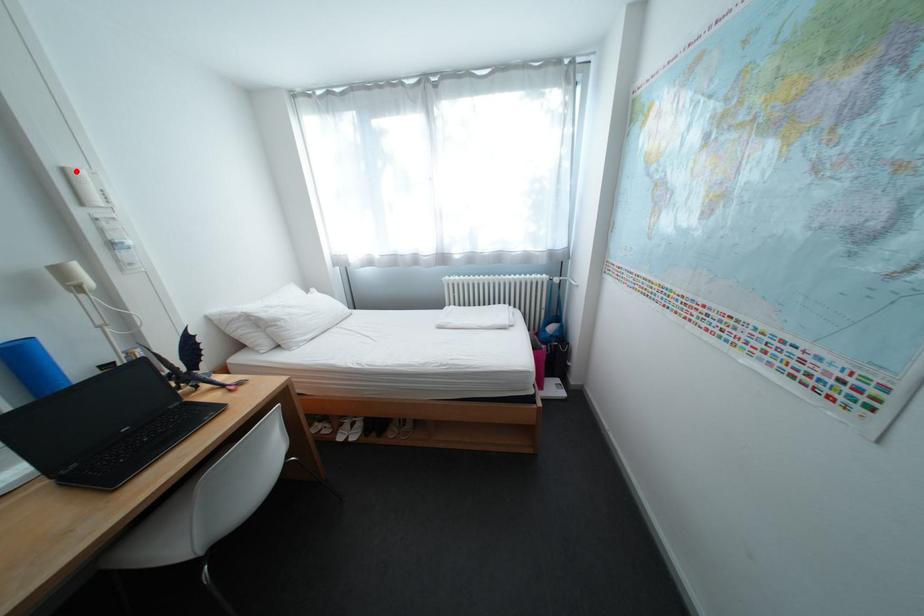
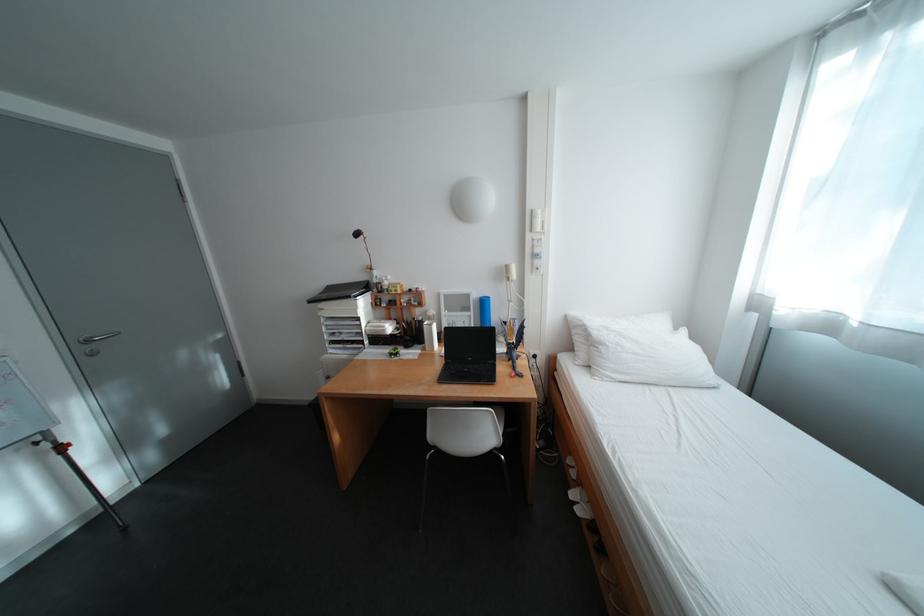
Find the pixel in the second image that matches the highlighted location in the first image.

(544, 213)